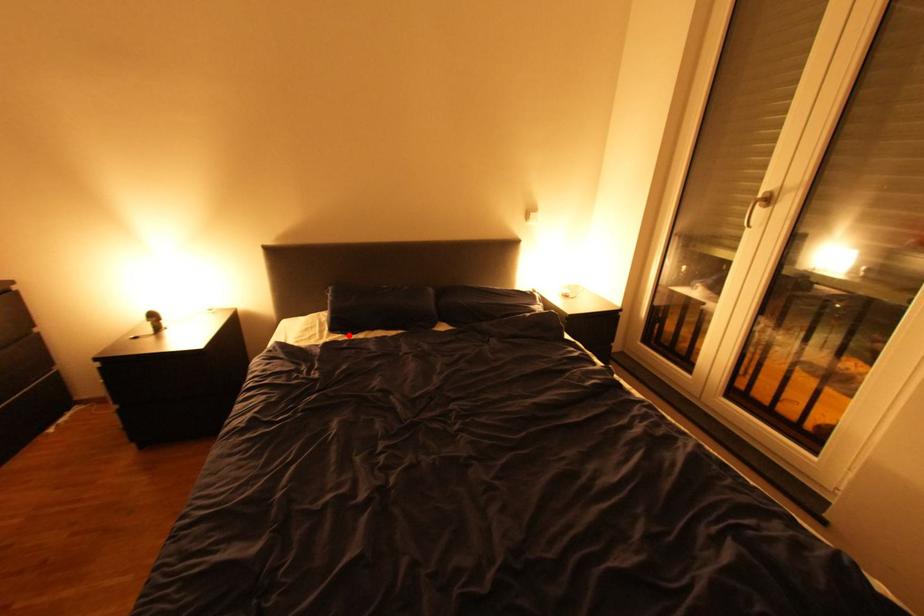
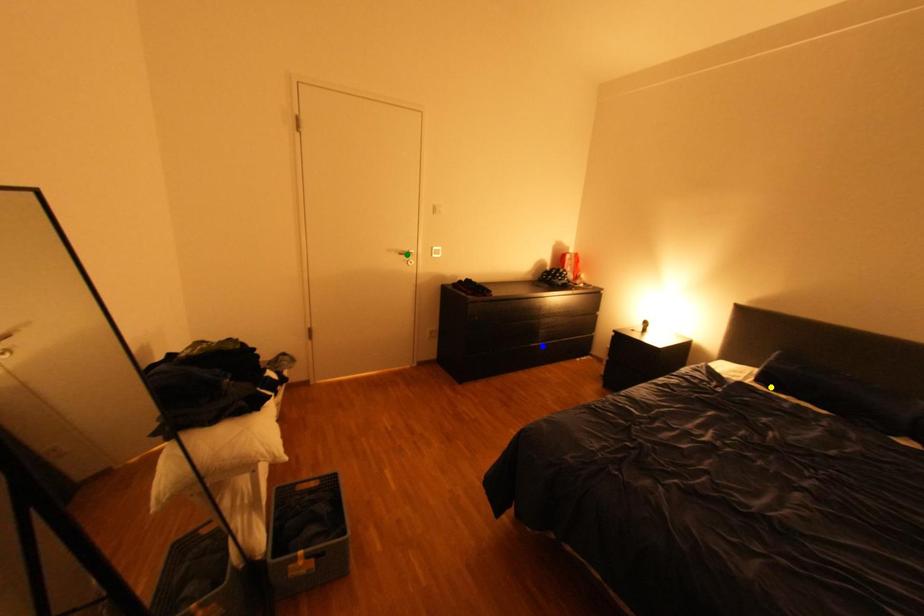
Question: I am providing you with two images of the same scene from different viewpoints. A red point is marked on the first image. You are given multiple points on the second image. Which point in image 2 represents the same 3d spot as the red point in image 1?

Choices:
 (A) blue point
 (B) green point
 (C) yellow point

Answer: (C)